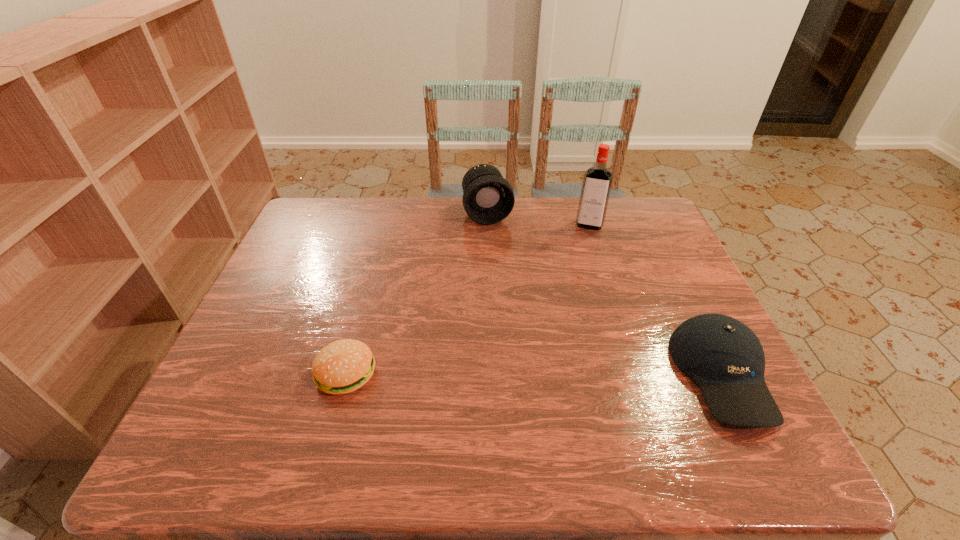
The image size is (960, 540). I want to click on vacant spot on the desktop that is between the leftmost object and the third tallest object and is positioned on the front and back of the tallest object, so click(x=557, y=374).

You are a GUI agent. You are given a task and a screenshot of the screen. Output one action in this format:
    pyautogui.click(x=<x>, y=<y>)
    Task: Click on the vacant space on the desktop that is between the leftmost object and the baseball cap and is positioned at the front element of the telephoto lens
    
    Given the screenshot: What is the action you would take?
    [543, 374]